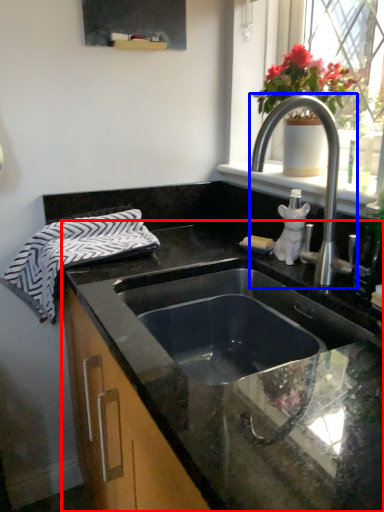
Question: Which object appears closest to the camera in this image, countertop (highlighted by a red box) or tap (highlighted by a blue box)?

Choices:
 (A) countertop
 (B) tap

Answer: (A)